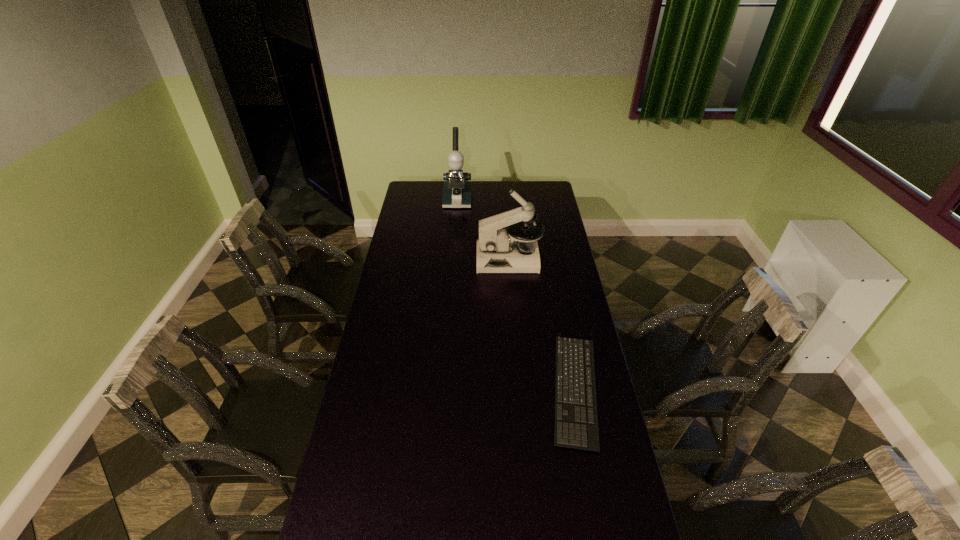
Locate an element on the screen. The image size is (960, 540). the farther microscope is located at coordinates (457, 189).

Where is `the farthest object`? The height and width of the screenshot is (540, 960). the farthest object is located at coordinates (457, 189).

Identify the location of the nearer microscope. (499, 250).

Where is `the second nearest object`? This screenshot has width=960, height=540. the second nearest object is located at coordinates (499, 250).

This screenshot has width=960, height=540. I want to click on the nearest object, so click(x=570, y=434).

At what (x,y) coordinates should I click in order to perform the action: click on computer keyboard. Please return your answer as a coordinate pair (x, y). Looking at the image, I should click on [x=570, y=434].

Locate an element on the screen. This screenshot has width=960, height=540. vacant region located at the eyepiece of the farthest object is located at coordinates (454, 235).

This screenshot has width=960, height=540. I want to click on vacant space located 0.300m at the eyepiece of the second nearest object, so click(x=416, y=259).

This screenshot has height=540, width=960. I want to click on vacant area located 0.090m at the eyepiece of the second nearest object, so 459,259.

The width and height of the screenshot is (960, 540). Identify the location of free space located at the eyepiece of the second nearest object. (408, 259).